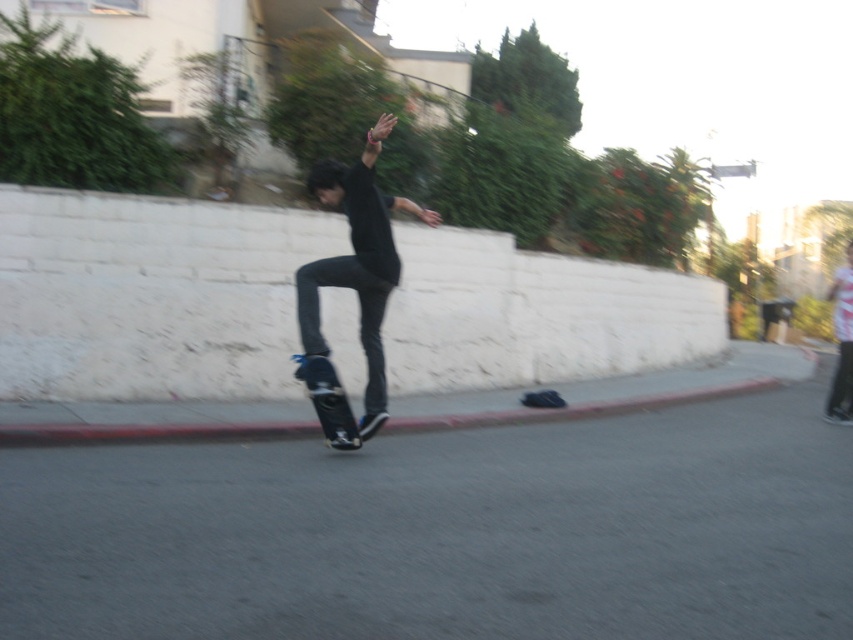
Question: Can you confirm if matte black skateboard at center is wider than red concrete curb at lower center?

Choices:
 (A) no
 (B) yes

Answer: (A)

Question: Which is nearer to the red concrete curb at lower center?

Choices:
 (A) gray asphalt pavement at center
 (B) matte black skateboard at center
 (C) black matte skateboard at center

Answer: (C)

Question: Does matte black skateboard at center appear on the left side of black matte skateboard at center?

Choices:
 (A) no
 (B) yes

Answer: (A)

Question: Which point is farther to the camera?

Choices:
 (A) matte black skateboard at center
 (B) black matte skateboard at center
 (C) red concrete curb at lower center
 (D) gray asphalt pavement at center

Answer: (C)

Question: Which of these objects is positioned farthest from the matte black skateboard at center?

Choices:
 (A) red concrete curb at lower center
 (B) gray asphalt pavement at center
 (C) black matte skateboard at center

Answer: (B)

Question: Can you confirm if gray asphalt pavement at center is positioned to the right of matte black skateboard at center?

Choices:
 (A) yes
 (B) no

Answer: (B)